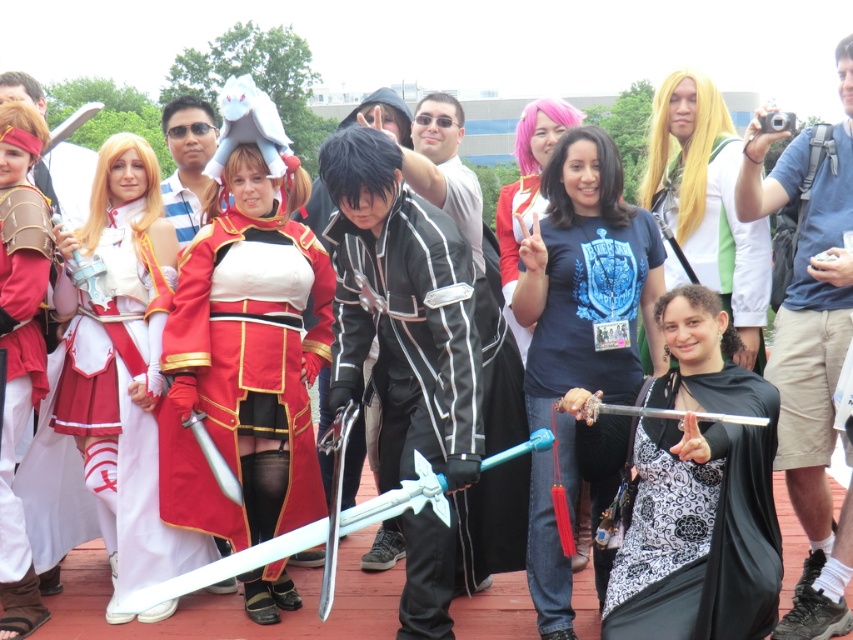
You are organizing a photoshoot and need to position the shiny red fabric dress at center and the black satin cape at center on a narrow runway. Given the runway is only 1.2 meters wide, will both items fit side by side without overlapping?

The shiny red fabric dress at center is narrower than the black satin cape at center. However, since the total width of both items combined may exceed 1.2 meters, they might not fit side by side without overlapping. Check their combined width to confirm.

You are a photographer at the cosplay event and want to capture a photo where both the black satin cape at center and the green fabric dress at center are clearly visible. Based on their positions, which one should you adjust to ensure both are in the frame?

The black satin cape at center is positioned under the green fabric dress at center. To ensure both are visible, you should adjust the green fabric dress at center to move it slightly upward or to the side so that it doesn not block the black satin cape at center.

Looking at this image, you are standing at the center of the wooden deck at a cosplay event. You need to find the blue denim shorts at lower right. Which direction should you look to locate them?

The blue denim shorts at lower right are located at point 0.536 on the x axis and 0.951 on the y axis, so you should look towards the lower right direction to find them.